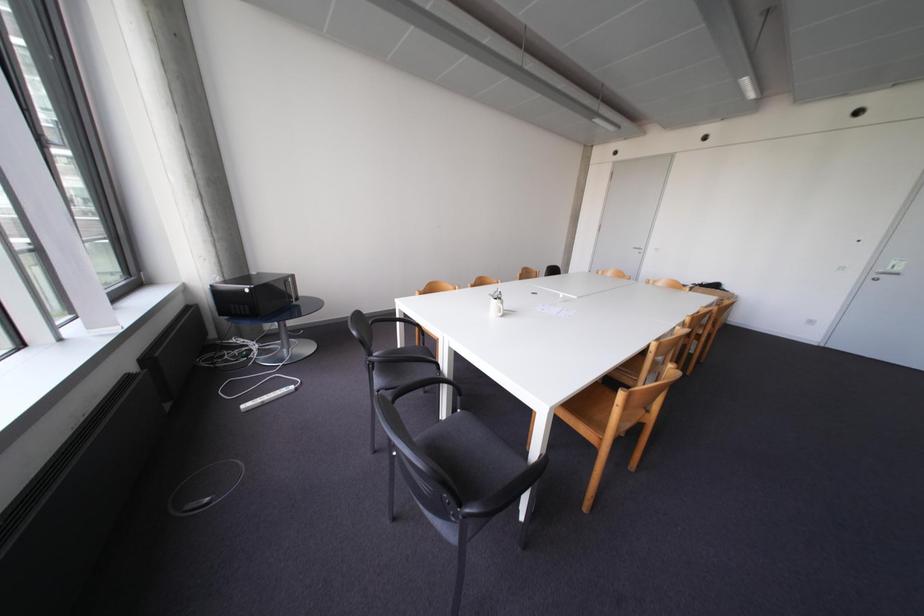
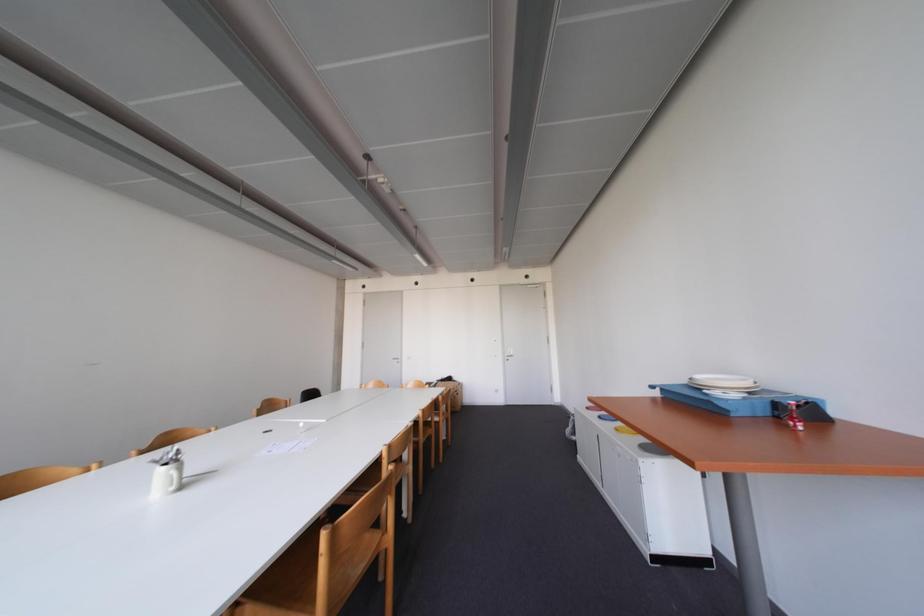
Based on the continuous images, in which direction is the camera rotating?

The camera's rotation is toward right-up.